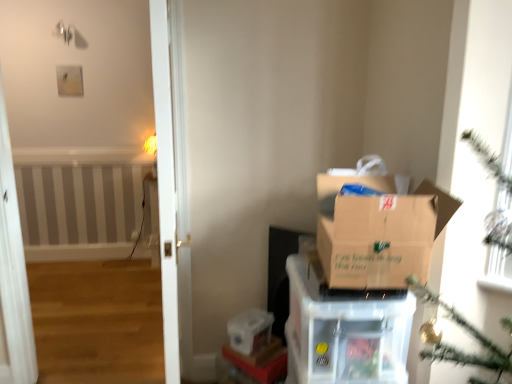
Question: Is clear plastic storage box at lower center thinner than brown cardboard box at right?

Choices:
 (A) no
 (B) yes

Answer: (B)

Question: Is clear plastic storage box at lower center at the left side of brown cardboard box at right?

Choices:
 (A) yes
 (B) no

Answer: (A)

Question: From the image's perspective, is clear plastic storage box at lower center under brown cardboard box at right?

Choices:
 (A) yes
 (B) no

Answer: (A)

Question: Is the surface of clear plastic storage box at lower center in direct contact with brown cardboard box at right?

Choices:
 (A) no
 (B) yes

Answer: (A)

Question: Does clear plastic storage box at lower center lie behind brown cardboard box at right?

Choices:
 (A) no
 (B) yes

Answer: (B)

Question: Is brown cardboard box at center in front of or behind brown cardboard box at right in the image?

Choices:
 (A) behind
 (B) front

Answer: (A)

Question: From a real-world perspective, is brown cardboard box at center positioned above or below brown cardboard box at right?

Choices:
 (A) above
 (B) below

Answer: (B)

Question: Looking at their shapes, would you say brown cardboard box at center is wider or thinner than brown cardboard box at right?

Choices:
 (A) thin
 (B) wide

Answer: (B)

Question: Do you think brown cardboard box at center is within brown cardboard box at right, or outside of it?

Choices:
 (A) inside
 (B) outside

Answer: (B)

Question: Does point (247, 319) appear closer or farther from the camera than point (241, 355)?

Choices:
 (A) closer
 (B) farther

Answer: (B)

Question: Considering the relative positions of clear plastic storage box at lower center and clear plastic container at lower center in the image provided, is clear plastic storage box at lower center to the left or to the right of clear plastic container at lower center?

Choices:
 (A) right
 (B) left

Answer: (B)

Question: In terms of height, does clear plastic storage box at lower center look taller or shorter compared to clear plastic container at lower center?

Choices:
 (A) short
 (B) tall

Answer: (B)

Question: From a real-world perspective, is clear plastic storage box at lower center above or below clear plastic container at lower center?

Choices:
 (A) below
 (B) above

Answer: (B)

Question: Based on their sizes in the image, would you say clear plastic container at lower center is bigger or smaller than clear plastic storage box at lower center?

Choices:
 (A) big
 (B) small

Answer: (B)

Question: Does point (237, 352) appear closer or farther from the camera than point (245, 311)?

Choices:
 (A) farther
 (B) closer

Answer: (B)